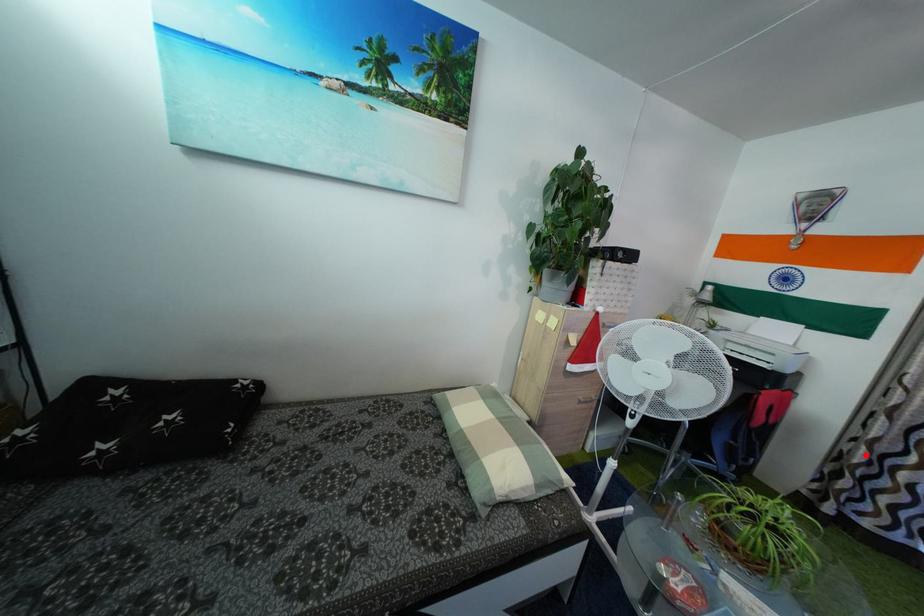
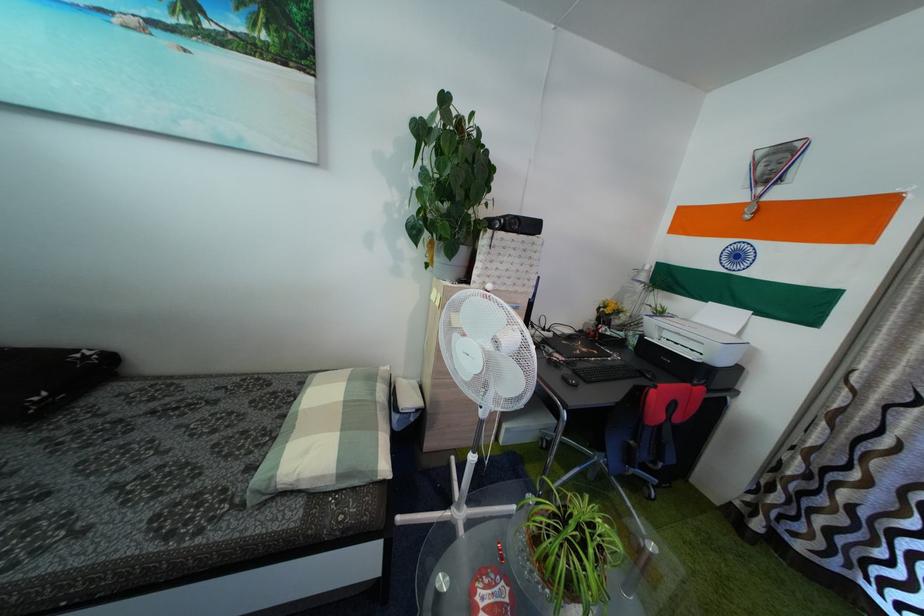
Question: I am providing you with two images of the same scene from different viewpoints. A red point is marked on the first image. Is the red point's position out of view in image 2?

Choices:
 (A) Yes
 (B) No

Answer: (B)